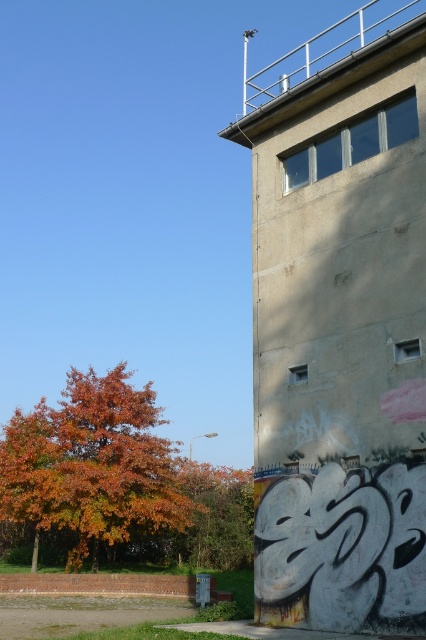
You are a gardener who needs to water both orange leafy tree at lower left and orange leafy tree at left. Your watering can holds enough water to cover 12 feet. Can you water both trees without refilling?

The distance between orange leafy tree at lower left and orange leafy tree at left is 13.12 feet, which is more than your watering can capacity of 12 feet. Therefore, you cannot water both trees without refilling.

You are standing at the origin point of the coordinate system. The orange leafy tree at lower left is located at point 0.727, 0.216. If you want to walk directly to the tree, which direction should you move in? Please provide your answer in terms of the coordinate system direction.

To reach the orange leafy tree at lower left located at point [92,465] from the origin, you should move in the positive x and positive y directions since both coordinates are greater than zero.